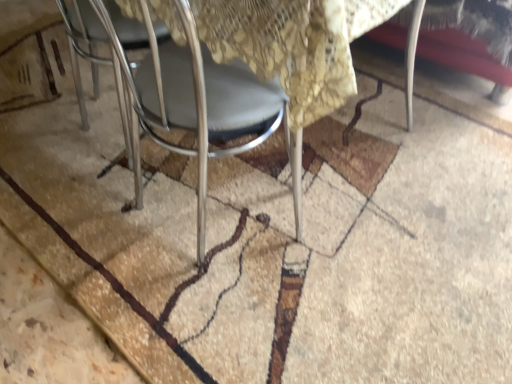
Question: Is brown textured mat at center at the left side of metallic gray chair at center?

Choices:
 (A) yes
 (B) no

Answer: (A)

Question: From a real-world perspective, is brown textured mat at center over metallic gray chair at center?

Choices:
 (A) yes
 (B) no

Answer: (B)

Question: Is brown textured mat at center taller than metallic gray chair at center?

Choices:
 (A) yes
 (B) no

Answer: (B)

Question: From the image's perspective, is brown textured mat at center under metallic gray chair at center?

Choices:
 (A) no
 (B) yes

Answer: (A)

Question: Is the depth of brown textured mat at center greater than that of metallic gray chair at center?

Choices:
 (A) no
 (B) yes

Answer: (B)

Question: From a real-world perspective, does brown textured mat at center sit lower than metallic gray chair at center?

Choices:
 (A) yes
 (B) no

Answer: (A)

Question: Does metallic gray chair at center have a greater height compared to brown textured mat at center?

Choices:
 (A) yes
 (B) no

Answer: (A)

Question: Can you confirm if metallic gray chair at center is thinner than brown textured mat at center?

Choices:
 (A) no
 (B) yes

Answer: (B)

Question: Does metallic gray chair at center have a larger size compared to brown textured mat at center?

Choices:
 (A) no
 (B) yes

Answer: (A)

Question: Is metallic gray chair at center not within brown textured mat at center?

Choices:
 (A) yes
 (B) no

Answer: (A)

Question: Does metallic gray chair at center have a lesser height compared to brown textured mat at center?

Choices:
 (A) yes
 (B) no

Answer: (B)

Question: Is metallic gray chair at center at the left side of brown textured mat at center?

Choices:
 (A) yes
 (B) no

Answer: (B)

Question: From a real-world perspective, relative to brown textured mat at center, is metallic gray chair at center vertically above or below?

Choices:
 (A) above
 (B) below

Answer: (A)